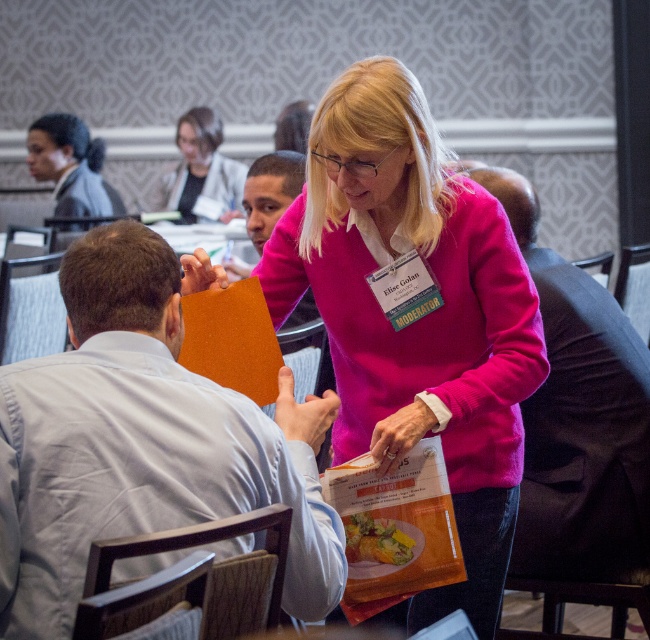
Consider the image. Is matte black shirt at center below pink matte sweater at center?

Yes, matte black shirt at center is below pink matte sweater at center.

Is matte black shirt at center positioned in front of pink matte sweater at center?

Yes, it is.

I want to click on matte black shirt at center, so click(578, 419).

Does matte orange folder at center appear over matte black shirt at center?

Actually, matte orange folder at center is below matte black shirt at center.

Which of these two, matte orange folder at center or matte black shirt at center, stands shorter?

With less height is matte orange folder at center.

The height and width of the screenshot is (640, 650). Describe the element at coordinates (143, 442) in the screenshot. I see `matte orange folder at center` at that location.

Where is `matte orange folder at center`? matte orange folder at center is located at coordinates [x=143, y=442].

Can you confirm if matte black shirt at center is shorter than matte pink sweater at upper center?

No, matte black shirt at center is not shorter than matte pink sweater at upper center.

Does point (541, 307) lie behind point (242, 173)?

That is False.

Find the location of a particular element. Image resolution: width=650 pixels, height=640 pixels. matte black shirt at center is located at coordinates [x=578, y=419].